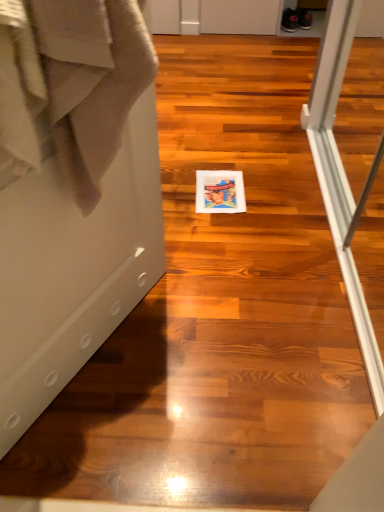
This screenshot has width=384, height=512. What are the coordinates of `vacant space to the right of matte paper postcard at center` in the screenshot? It's located at (273, 198).